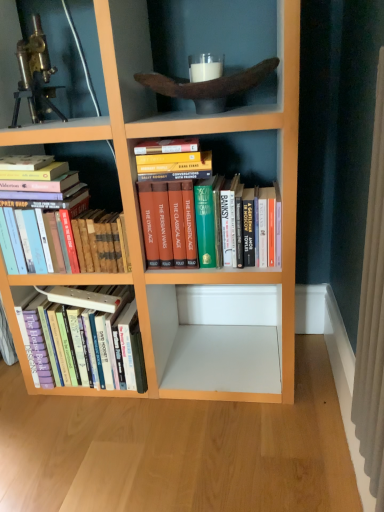
Question: Is hardcover books at left, the 1th book ordered from the bottom, shorter than brass metallic telescope at upper left?

Choices:
 (A) yes
 (B) no

Answer: (B)

Question: From a real-world perspective, is hardcover books at left, the 1th book ordered from the bottom, below brass metallic telescope at upper left?

Choices:
 (A) yes
 (B) no

Answer: (A)

Question: Would you say hardcover books at left, the 1th book ordered from the bottom, contains brass metallic telescope at upper left?

Choices:
 (A) no
 (B) yes

Answer: (A)

Question: Is the position of hardcover books at left, the third book from the top, less distant than that of brass metallic telescope at upper left?

Choices:
 (A) yes
 (B) no

Answer: (B)

Question: Considering the relative sizes of hardcover books at left, the 1th book ordered from the bottom, and brass metallic telescope at upper left in the image provided, is hardcover books at left, the 1th book ordered from the bottom, wider than brass metallic telescope at upper left?

Choices:
 (A) no
 (B) yes

Answer: (B)

Question: Can you confirm if hardcover books at left, the third book from the top, is thinner than brass metallic telescope at upper left?

Choices:
 (A) no
 (B) yes

Answer: (A)

Question: Is brass metallic telescope at upper left next to hardcover books at center, which is the third book in bottom-to-top order?

Choices:
 (A) yes
 (B) no

Answer: (B)

Question: Considering the relative sizes of brass metallic telescope at upper left and hardcover books at center, which is the 1th book from top to bottom, in the image provided, is brass metallic telescope at upper left shorter than hardcover books at center, which is the 1th book from top to bottom,?

Choices:
 (A) no
 (B) yes

Answer: (B)

Question: From a real-world perspective, is brass metallic telescope at upper left located higher than hardcover books at center, which is the third book in bottom-to-top order?

Choices:
 (A) no
 (B) yes

Answer: (B)

Question: Can hardcover books at center, which is the third book in bottom-to-top order, be found inside brass metallic telescope at upper left?

Choices:
 (A) yes
 (B) no

Answer: (B)

Question: Is brass metallic telescope at upper left outside of hardcover books at center, which is the third book in bottom-to-top order?

Choices:
 (A) yes
 (B) no

Answer: (A)

Question: From a real-world perspective, does brass metallic telescope at upper left sit lower than hardcover books at center, which is the third book in bottom-to-top order?

Choices:
 (A) no
 (B) yes

Answer: (A)

Question: Is hardcover books at left, which is the second book in top-to-bottom order, oriented away from brass metallic telescope at upper left?

Choices:
 (A) no
 (B) yes

Answer: (A)